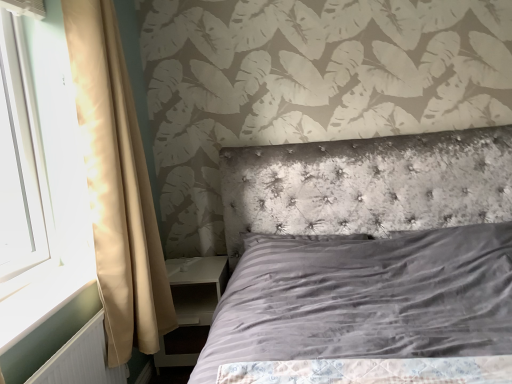
Locate an element on the screen. The image size is (512, 384). beige satin curtain at left is located at coordinates (117, 186).

Measure the distance between white plastic radiator at lower left and camera.

white plastic radiator at lower left and camera are 4.20 feet apart from each other.

The width and height of the screenshot is (512, 384). What are the coordinates of `velvet tufted headboard at center` in the screenshot? It's located at (366, 252).

How many degrees apart are the facing directions of velvet tufted headboard at center and beige satin curtain at left?

91.1 degrees separate the facing orientations of velvet tufted headboard at center and beige satin curtain at left.

Between velvet tufted headboard at center and beige satin curtain at left, which one has less height?

velvet tufted headboard at center.

From the image's perspective, is velvet tufted headboard at center located above or below beige satin curtain at left?

velvet tufted headboard at center is below beige satin curtain at left.

Is velvet tufted headboard at center looking in the opposite direction of beige satin curtain at left?

No, velvet tufted headboard at center is not facing the opposite direction of beige satin curtain at left.

Would you say white plastic window screen at left is inside or outside white glossy wood at left?

white plastic window screen at left is outside white glossy wood at left.

Which object is thinner, white plastic window screen at left or white glossy wood at left?

Thinner between the two is white plastic window screen at left.

Identify the location of window screen above the white glossy wood at left (from the image's perspective). (20, 160).

Does white plastic window screen at left have a larger size compared to white glossy wood at left?

Yes.

Who is smaller, velvet tufted headboard at center or white plastic radiator at lower left?

Smaller between the two is white plastic radiator at lower left.

Considering the relative sizes of velvet tufted headboard at center and white plastic radiator at lower left in the image provided, is velvet tufted headboard at center shorter than white plastic radiator at lower left?

Incorrect, the height of velvet tufted headboard at center does not fall short of that of white plastic radiator at lower left.

Is point (297, 276) behind point (122, 370)?

Yes.

Can you see beige satin curtain at left touching white glossy nightstand at lower left?

beige satin curtain at left and white glossy nightstand at lower left are clearly separated.

Does beige satin curtain at left turn towards white glossy nightstand at lower left?

No, beige satin curtain at left is not aimed at white glossy nightstand at lower left.

Which is less distant, (94, 134) or (216, 279)?

Point (94, 134) is positioned closer to the camera compared to point (216, 279).

How far apart are beige satin curtain at left and white glossy nightstand at lower left?

beige satin curtain at left is 20.65 inches away from white glossy nightstand at lower left.

Considering the sizes of objects velvet tufted headboard at center and white glossy nightstand at lower left in the image provided, who is shorter, velvet tufted headboard at center or white glossy nightstand at lower left?

Answer: Standing shorter between the two is white glossy nightstand at lower left.

Is white glossy nightstand at lower left at the back of velvet tufted headboard at center?

velvet tufted headboard at center is not turned away from white glossy nightstand at lower left.

Is velvet tufted headboard at center bigger than white glossy nightstand at lower left?

Yes, velvet tufted headboard at center is bigger than white glossy nightstand at lower left.

From the image's perspective, which one is positioned higher, velvet tufted headboard at center or white glossy nightstand at lower left?

velvet tufted headboard at center, from the image's perspective.

At what (x,y) coordinates should I click in order to perform the action: click on nightstand beneath the white plastic radiator at lower left (from a real-world perspective). Please return your answer as a coordinate pair (x, y). Looking at the image, I should click on (197, 287).

Is white plastic radiator at lower left at the back of white glossy nightstand at lower left?

white glossy nightstand at lower left is not turned away from white plastic radiator at lower left.

How much distance is there between white glossy nightstand at lower left and white plastic radiator at lower left?

A distance of 26.62 inches exists between white glossy nightstand at lower left and white plastic radiator at lower left.

Based on the photo, choose the correct answer: Is white glossy nightstand at lower left inside white plastic radiator at lower left or outside it?

white glossy nightstand at lower left is outside white plastic radiator at lower left.

What are the coordinates of `bed that appears above the white plastic radiator at lower left (from a real-world perspective)` in the screenshot? It's located at (366, 252).

From the image's perspective, is white plastic radiator at lower left located above velvet tufted headboard at center?

No, from the image's perspective, white plastic radiator at lower left is not on top of velvet tufted headboard at center.

Is white plastic radiator at lower left closer to camera compared to velvet tufted headboard at center?

No, it is not.

The image size is (512, 384). I want to click on curtain above the velvet tufted headboard at center (from the image's perspective), so click(x=117, y=186).

I want to click on window sill below the white plastic window screen at left (from a real-world perspective), so click(40, 303).

Based on their spatial positions, is beige satin curtain at left or white glossy wood at left closer to velvet tufted headboard at center?

beige satin curtain at left.

When comparing their distances from white glossy wood at left, does beige satin curtain at left or white plastic radiator at lower left seem closer?

white plastic radiator at lower left.

When comparing their distances from white glossy nightstand at lower left, does beige satin curtain at left or velvet tufted headboard at center seem further?

velvet tufted headboard at center is positioned further to the anchor white glossy nightstand at lower left.

When comparing their distances from white glossy wood at left, does white plastic window screen at left or velvet tufted headboard at center seem closer?

Among the two, white plastic window screen at left is located nearer to white glossy wood at left.

In the scene shown: Based on their spatial positions, is white plastic radiator at lower left or white plastic window screen at left closer to white glossy wood at left?

white plastic radiator at lower left lies closer to white glossy wood at left than the other object.

Looking at this image, considering their positions, is white plastic radiator at lower left positioned closer to beige satin curtain at left than white plastic window screen at left?

Among the two, white plastic radiator at lower left is located nearer to beige satin curtain at left.

In the scene shown: Estimate the real-world distances between objects in this image. Which object is closer to white plastic radiator at lower left, white glossy nightstand at lower left or beige satin curtain at left?

The object closer to white plastic radiator at lower left is beige satin curtain at left.

Based on their spatial positions, is white plastic radiator at lower left or velvet tufted headboard at center further from white glossy wood at left?

Based on the image, velvet tufted headboard at center appears to be further to white glossy wood at left.

The image size is (512, 384). What are the coordinates of `window screen located between velvet tufted headboard at center and white glossy nightstand at lower left in the depth direction` in the screenshot? It's located at (20, 160).

I want to click on curtain situated between white plastic window screen at left and velvet tufted headboard at center from left to right, so click(x=117, y=186).

This screenshot has height=384, width=512. I want to click on radiator between velvet tufted headboard at center and beige satin curtain at left along the z-axis, so click(81, 359).

Where is `radiator situated between white glossy wood at left and velvet tufted headboard at center from left to right`? radiator situated between white glossy wood at left and velvet tufted headboard at center from left to right is located at coordinates (81, 359).